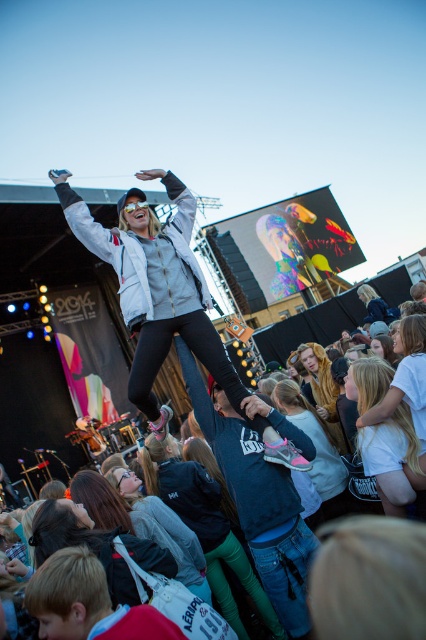
You are standing at the concert and want to take a photo of the point located at coordinates point (394,480). If your camera has a focal length of 50mm and you are 13.27 meters away from the point, what is the angle of view required to capture the point in the frame?

The point (394,480) is 13.27 meters away from the viewer. To calculate the angle of view needed, use the formula angle of view in degrees equals arctangent of object distance divided by focal length. Plugging in the values, the angle of view required would be arctangent of 13.27 divided by 0.05 meters, which is approximately 86.7 degrees.

You are a photographer trying to capture a candid shot of the two central figures in the crowd at the concert. The dark blue jeans at center and the dark gray hoodie at center are both in your frame. Based on their heights, which one should you focus on first to ensure they are in focus without adjusting your camera settings?

The dark gray hoodie at center is taller than the dark blue jeans at center. Since the dark gray hoodie at center is taller, it would be further away from the camera, so focusing on the dark blue jeans at center first would ensure proper focus on both without needing adjustments.